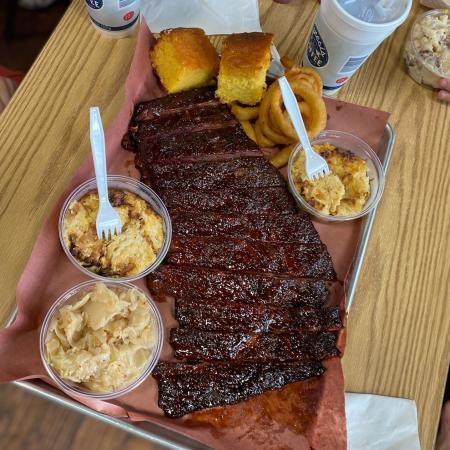
Where is `cup`? Image resolution: width=450 pixels, height=450 pixels. cup is located at coordinates (355, 52).